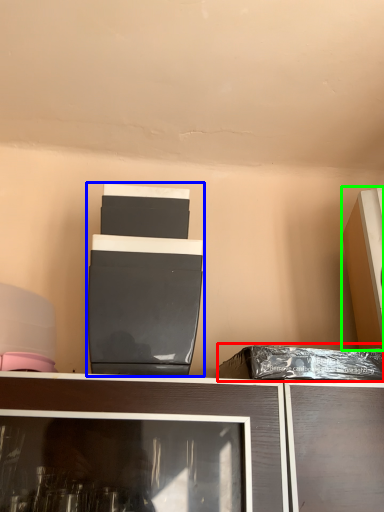
Question: Which object is positioned farthest from garbage (highlighted by a red box)? Select from appliance (highlighted by a blue box) and appliance (highlighted by a green box).

Choices:
 (A) appliance
 (B) appliance

Answer: (A)